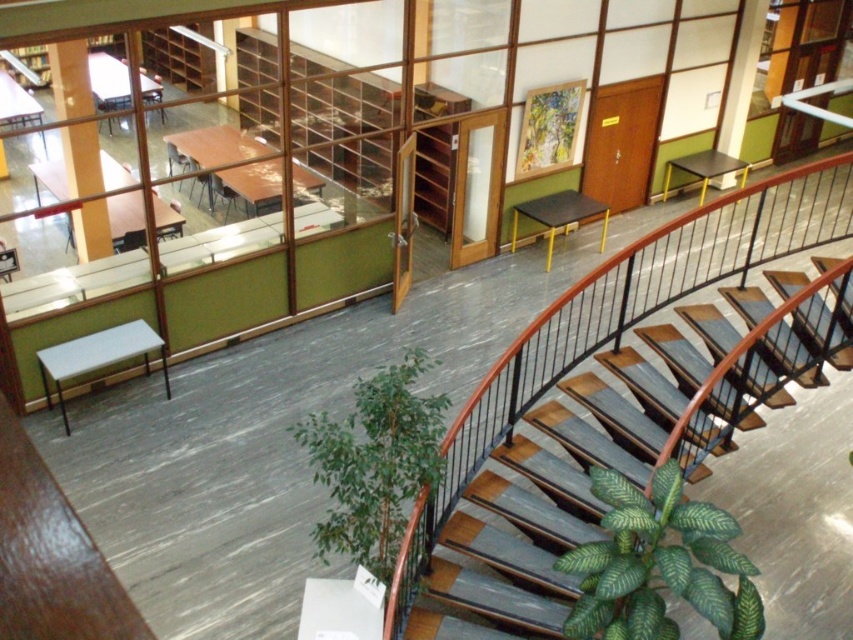
You are a maintenance worker needing to place a 1.2 meter wide equipment on the floor. You have two options for placement areas next to either the wooden stairs at center or the matte white pillar at upper left. Which location has enough space to accommodate the equipment without overlapping?

The wooden stairs at center might be wider than matte white pillar at upper left, so placing the equipment next to the wooden stairs at center is more likely to have sufficient space compared to the matte white pillar at upper left.

You are standing at the point marked as point (624, 448) in the image. What object are you standing on?

You are standing on the wooden stairs at center marked by point (624, 448).

You are standing on the upper level of the library looking down. You need to place a small potted plant between the green leafy plant at center and the matte white pillar at upper right. Which object should you move closer to ensure the new plant fits between them?

The green leafy plant at center is closer to the viewer than the matte white pillar at upper right. To place the new plant between them, move it closer to the matte white pillar at upper right so there is enough space between the two existing objects.